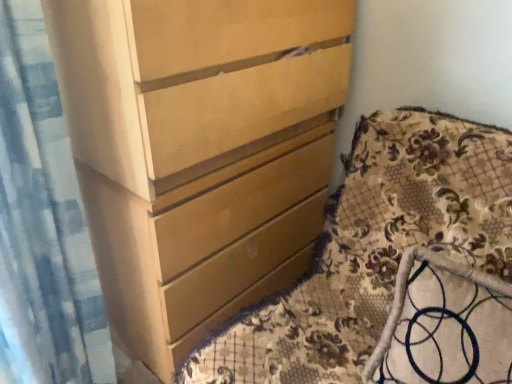
Locate an element on the screen. The width and height of the screenshot is (512, 384). matte wood chest of drawers at center is located at coordinates (199, 151).

This screenshot has height=384, width=512. Identify the location of blue textured fabric at left. (42, 223).

Locate an element on the screen. matte wood chest of drawers at center is located at coordinates (199, 151).

Which point is more distant from viewer, (377, 346) or (122, 338)?

The point (122, 338) is farther from the camera.

Considering the relative sizes of floral fabric cushion at lower right and matte wood chest of drawers at center in the image provided, is floral fabric cushion at lower right bigger than matte wood chest of drawers at center?

Incorrect, floral fabric cushion at lower right is not larger than matte wood chest of drawers at center.

Does floral fabric cushion at lower right touch matte wood chest of drawers at center?

No, floral fabric cushion at lower right is not with matte wood chest of drawers at center.

Who is taller, floral fabric cushion at lower right or matte wood chest of drawers at center?

Standing taller between the two is matte wood chest of drawers at center.

Considering the positions of points (157, 290) and (501, 285), is point (157, 290) farther from camera compared to point (501, 285)?

Yes.

Can you confirm if matte wood chest of drawers at center is wider than floral fabric cushion at lower right?

Indeed, matte wood chest of drawers at center has a greater width compared to floral fabric cushion at lower right.

Which is correct: matte wood chest of drawers at center is inside floral fabric cushion at lower right, or outside of it?

The correct answer is: outside.

From the image's perspective, is blue textured fabric at left over floral fabric cushion at lower right?

Yes.

Is blue textured fabric at left spatially inside floral fabric cushion at lower right, or outside of it?

blue textured fabric at left is located beyond the bounds of floral fabric cushion at lower right.

Does blue textured fabric at left turn towards floral fabric cushion at lower right?

No, blue textured fabric at left is not turned towards floral fabric cushion at lower right.

Which is in front, blue textured fabric at left or floral fabric cushion at lower right?

floral fabric cushion at lower right is in front.

Locate an element on the screen. shower curtain above the floral fabric cushion at lower right (from the image's perspective) is located at coordinates (42, 223).

Is the position of floral fabric cushion at lower right more distant than that of blue textured fabric at left?

No.

From the picture: From the image's perspective, is floral fabric cushion at lower right over blue textured fabric at left?

Incorrect, from the image's perspective, floral fabric cushion at lower right is lower than blue textured fabric at left.

Is floral fabric cushion at lower right looking in the opposite direction of blue textured fabric at left?

That's not correct — floral fabric cushion at lower right is not looking away from blue textured fabric at left.

Can you confirm if blue textured fabric at left is smaller than matte wood chest of drawers at center?

Indeed, blue textured fabric at left has a smaller size compared to matte wood chest of drawers at center.

Would you say blue textured fabric at left is to the left or to the right of matte wood chest of drawers at center in the picture?

blue textured fabric at left is positioned on matte wood chest of drawers at center's left side.

Considering the sizes of blue textured fabric at left and matte wood chest of drawers at center in the image, is blue textured fabric at left wider or thinner than matte wood chest of drawers at center?

blue textured fabric at left is thinner than matte wood chest of drawers at center.

Does blue textured fabric at left have a greater height compared to matte wood chest of drawers at center?

In fact, blue textured fabric at left may be shorter than matte wood chest of drawers at center.

From a real-world perspective, is matte wood chest of drawers at center under blue textured fabric at left?

Yes, from a real-world perspective, matte wood chest of drawers at center is below blue textured fabric at left.

Who is shorter, matte wood chest of drawers at center or blue textured fabric at left?

Standing shorter between the two is blue textured fabric at left.

From the image's perspective, who appears lower, matte wood chest of drawers at center or blue textured fabric at left?

blue textured fabric at left appears lower in the image.

Can you confirm if matte wood chest of drawers at center is positioned to the right of blue textured fabric at left?

Correct, you'll find matte wood chest of drawers at center to the right of blue textured fabric at left.

At what (x,y) coordinates should I click in order to perform the action: click on chest of drawers above the floral fabric cushion at lower right (from a real-world perspective). Please return your answer as a coordinate pair (x, y). This screenshot has width=512, height=384. Looking at the image, I should click on (199, 151).

Find the location of `rocking chair on the right of the matte wood chest of drawers at center`. rocking chair on the right of the matte wood chest of drawers at center is located at coordinates (405, 296).

From the image, which object appears to be nearer to floral fabric cushion at lower right, blue textured fabric at left or matte wood chest of drawers at center?

matte wood chest of drawers at center is closer to floral fabric cushion at lower right.

Looking at the image, which one is located further to matte wood chest of drawers at center, blue textured fabric at left or floral fabric cushion at lower right?

floral fabric cushion at lower right lies further to matte wood chest of drawers at center than the other object.

Estimate the real-world distances between objects in this image. Which object is further from matte wood chest of drawers at center, floral fabric cushion at lower right or blue textured fabric at left?

floral fabric cushion at lower right lies further to matte wood chest of drawers at center than the other object.

From the image, which object appears to be farther from floral fabric cushion at lower right, matte wood chest of drawers at center or blue textured fabric at left?

The object further to floral fabric cushion at lower right is blue textured fabric at left.

Based on their spatial positions, is floral fabric cushion at lower right or matte wood chest of drawers at center further from blue textured fabric at left?

Among the two, floral fabric cushion at lower right is located further to blue textured fabric at left.

From the image, which object appears to be farther from blue textured fabric at left, matte wood chest of drawers at center or floral fabric cushion at lower right?

floral fabric cushion at lower right is further to blue textured fabric at left.

At what (x,y) coordinates should I click in order to perform the action: click on the chest of drawers located between blue textured fabric at left and floral fabric cushion at lower right in the left-right direction. Please return your answer as a coordinate pair (x, y). This screenshot has height=384, width=512. Looking at the image, I should click on (199, 151).